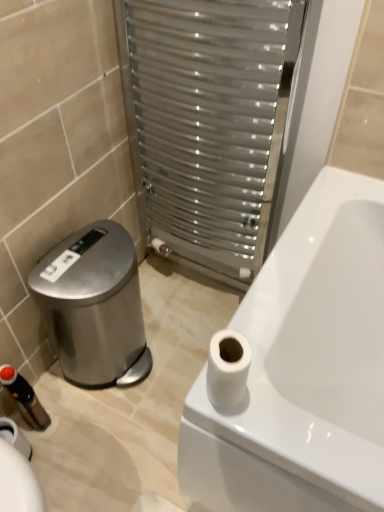
Question: Considering the relative positions of black plastic toiletry at lower left and white matte toilet paper at upper right in the image provided, is black plastic toiletry at lower left to the right of white matte toilet paper at upper right from the viewer's perspective?

Choices:
 (A) yes
 (B) no

Answer: (B)

Question: Would you say white matte toilet paper at upper right is part of black plastic toiletry at lower left's contents?

Choices:
 (A) no
 (B) yes

Answer: (A)

Question: Does black plastic toiletry at lower left have a smaller size compared to white matte toilet paper at upper right?

Choices:
 (A) no
 (B) yes

Answer: (A)

Question: Is black plastic toiletry at lower left placed right next to white matte toilet paper at upper right?

Choices:
 (A) yes
 (B) no

Answer: (B)

Question: Does black plastic toiletry at lower left have a greater width compared to white matte toilet paper at upper right?

Choices:
 (A) no
 (B) yes

Answer: (B)

Question: From the image's perspective, is polished stainless steel water cooler at lower left positioned above or below metallic silver radiator at center?

Choices:
 (A) below
 (B) above

Answer: (A)

Question: In the image, is polished stainless steel water cooler at lower left positioned in front of or behind metallic silver radiator at center?

Choices:
 (A) front
 (B) behind

Answer: (B)

Question: Is polished stainless steel water cooler at lower left wider or thinner than metallic silver radiator at center?

Choices:
 (A) wide
 (B) thin

Answer: (A)

Question: Considering the positions of polished stainless steel water cooler at lower left and metallic silver radiator at center in the image, is polished stainless steel water cooler at lower left bigger or smaller than metallic silver radiator at center?

Choices:
 (A) big
 (B) small

Answer: (B)

Question: Does point (33, 425) appear closer or farther from the camera than point (240, 399)?

Choices:
 (A) farther
 (B) closer

Answer: (A)

Question: In terms of width, does black plastic toiletry at lower left look wider or thinner when compared to white matte toilet paper at upper right?

Choices:
 (A) thin
 (B) wide

Answer: (B)

Question: From the image's perspective, relative to white matte toilet paper at upper right, is black plastic toiletry at lower left above or below?

Choices:
 (A) below
 (B) above

Answer: (A)

Question: Would you say black plastic toiletry at lower left is to the left or to the right of white matte toilet paper at upper right in the picture?

Choices:
 (A) left
 (B) right

Answer: (A)

Question: Is point (235, 388) positioned closer to the camera than point (19, 399)?

Choices:
 (A) closer
 (B) farther

Answer: (A)

Question: Is white matte toilet paper at upper right bigger or smaller than black plastic toiletry at lower left?

Choices:
 (A) small
 (B) big

Answer: (A)